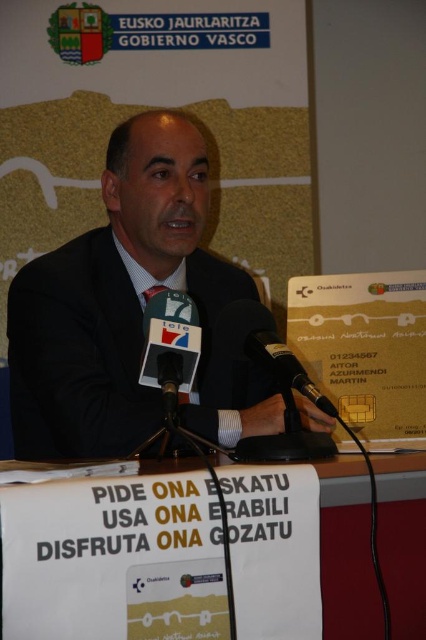
Question: Considering the relative positions of black matte suit at center and black matte microphone at center in the image provided, where is black matte suit at center located with respect to black matte microphone at center?

Choices:
 (A) left
 (B) right

Answer: (A)

Question: Based on their relative distances, which object is farther from the white paper at lower center?

Choices:
 (A) black plastic microphone at center
 (B) black matte suit at center

Answer: (B)

Question: Is black matte suit at center above black plastic microphone at center?

Choices:
 (A) no
 (B) yes

Answer: (B)

Question: Is black matte suit at center positioned in front of black plastic microphone at center?

Choices:
 (A) no
 (B) yes

Answer: (A)

Question: Estimate the real-world distances between objects in this image. Which object is closer to the black plastic microphone at center?

Choices:
 (A) white paper at lower center
 (B) black matte suit at center
 (C) black matte microphone at center

Answer: (C)

Question: Which of the following is the closest to the observer?

Choices:
 (A) black plastic microphone at center
 (B) white paper at lower center

Answer: (B)